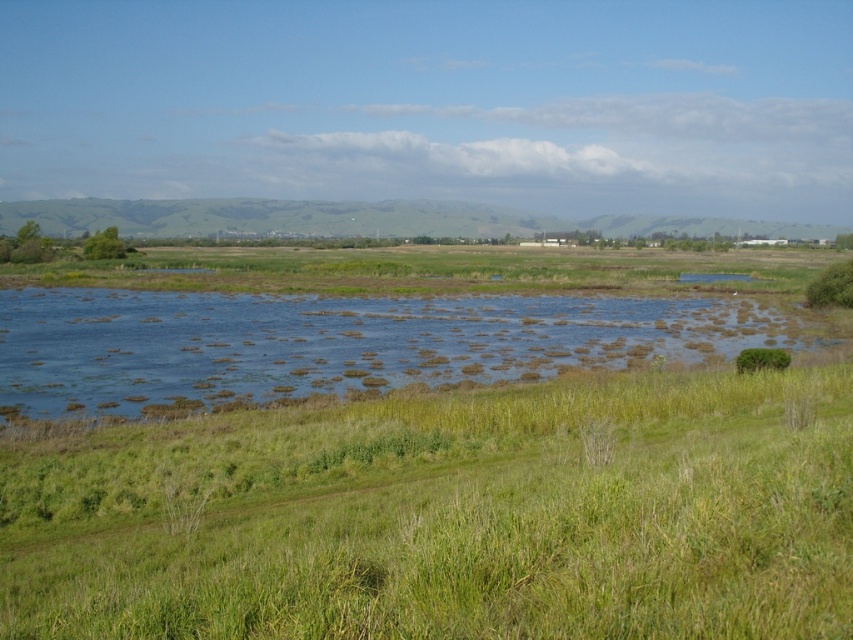
Question: Is green grassy at lower left below blue grassy river at center?

Choices:
 (A) yes
 (B) no

Answer: (A)

Question: Does green grassy at lower left have a lesser width compared to blue grassy river at center?

Choices:
 (A) yes
 (B) no

Answer: (A)

Question: Can you confirm if green grassy at lower left is positioned below blue grassy river at center?

Choices:
 (A) no
 (B) yes

Answer: (B)

Question: Which object appears farthest from the camera in this image?

Choices:
 (A) blue grassy river at center
 (B) green grassy at lower left

Answer: (A)